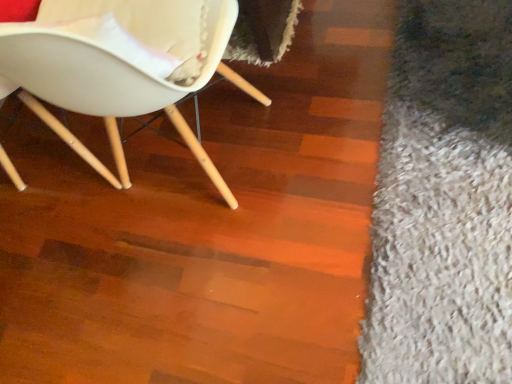
Where is `vacant space to the right of white matte plastic chair at upper left`? vacant space to the right of white matte plastic chair at upper left is located at coordinates (335, 132).